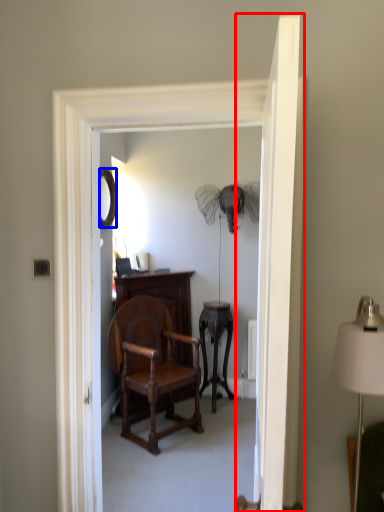
Question: Which object is further to the camera taking this photo, door (highlighted by a red box) or mirror (highlighted by a blue box)?

Choices:
 (A) door
 (B) mirror

Answer: (B)